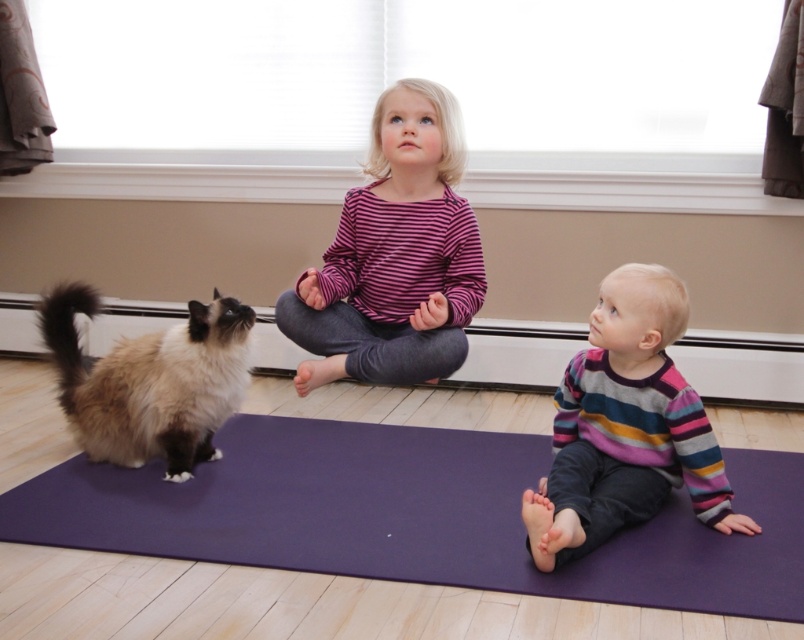
Question: In this image, where is striped cotton shirt at center located relative to soft cream fur cat at lower left?

Choices:
 (A) below
 (B) above

Answer: (B)

Question: In this image, where is striped sweater at lower right located relative to soft cream fur cat at lower left?

Choices:
 (A) right
 (B) left

Answer: (A)

Question: Among these objects, which one is farthest from the camera?

Choices:
 (A) purple yoga mat at lower center
 (B) striped sweater at lower right
 (C) soft cream fur cat at lower left

Answer: (C)

Question: Which of these objects is positioned farthest from the purple yoga mat at lower center?

Choices:
 (A) striped sweater at lower right
 (B) soft cream fur cat at lower left
 (C) striped cotton shirt at center

Answer: (C)

Question: Considering the relative positions of striped cotton shirt at center and soft cream fur cat at lower left in the image provided, where is striped cotton shirt at center located with respect to soft cream fur cat at lower left?

Choices:
 (A) right
 (B) left

Answer: (A)

Question: Which point is closer to the camera taking this photo?

Choices:
 (A) (306, 344)
 (B) (653, 289)

Answer: (B)